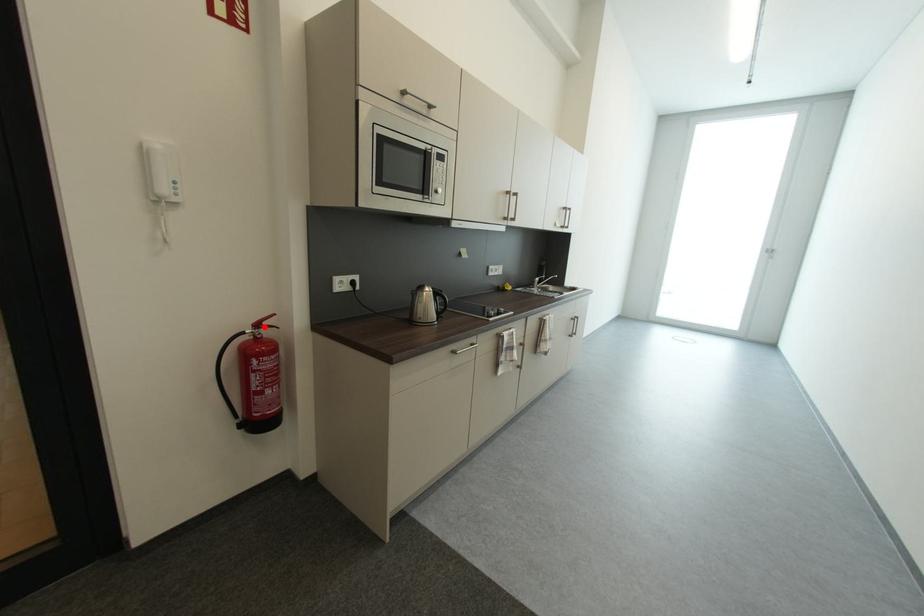
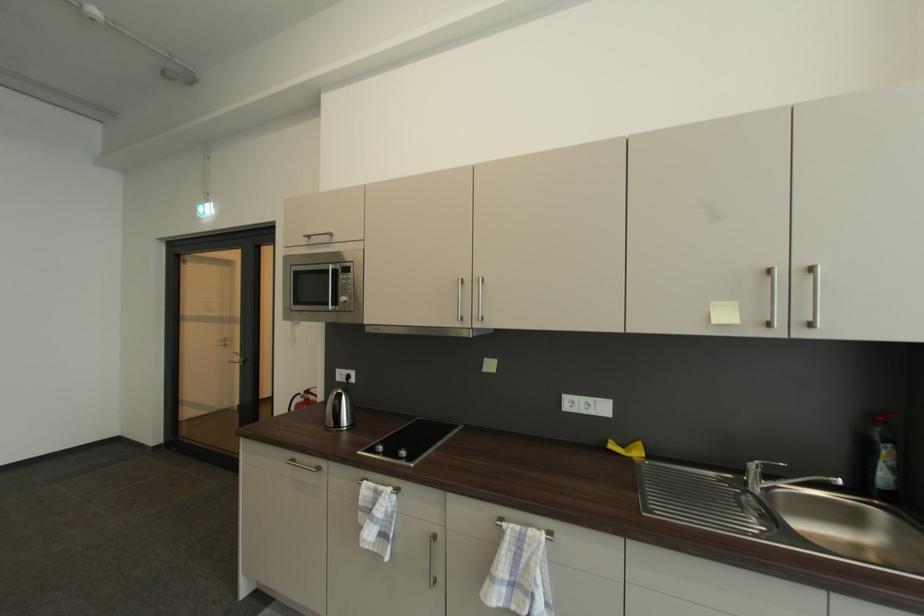
Find the pixel in the second image that matches the highlighted location in the first image.

(314, 392)